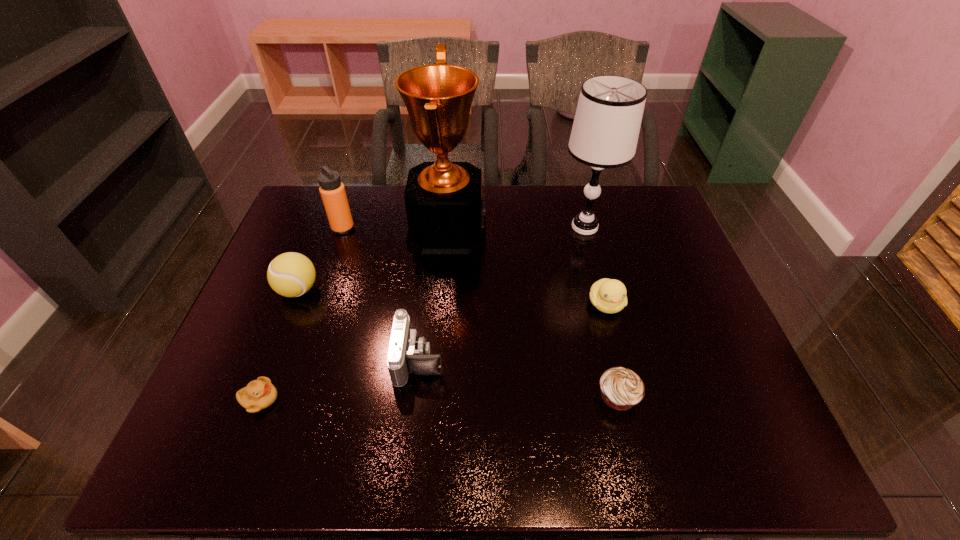
Locate an element on the screen. unoccupied area between the taller duckling and the tennis ball is located at coordinates (452, 297).

Identify the location of vacant area between the muffin and the camera. (518, 378).

The height and width of the screenshot is (540, 960). What are the coordinates of `object that is the sixth closest one to the tennis ball` in the screenshot? It's located at (608, 295).

Where is `object that is the fourth nearest to the trophy cup`? This screenshot has width=960, height=540. object that is the fourth nearest to the trophy cup is located at coordinates (606, 127).

Find the location of `free space that satisfies the following two spatial constraints: 1. on the front of the trophy cup with the label; 2. on the left side of the muffin`. free space that satisfies the following two spatial constraints: 1. on the front of the trophy cup with the label; 2. on the left side of the muffin is located at coordinates (434, 396).

This screenshot has height=540, width=960. Identify the location of vacant space that satisfies the following two spatial constraints: 1. on the back side of the thermos bottle; 2. on the left side of the tennis ball. (322, 228).

Find the location of a particular element. The image size is (960, 540). free region that satisfies the following two spatial constraints: 1. on the front of the trophy cup with the label; 2. on the back side of the muffin is located at coordinates (434, 396).